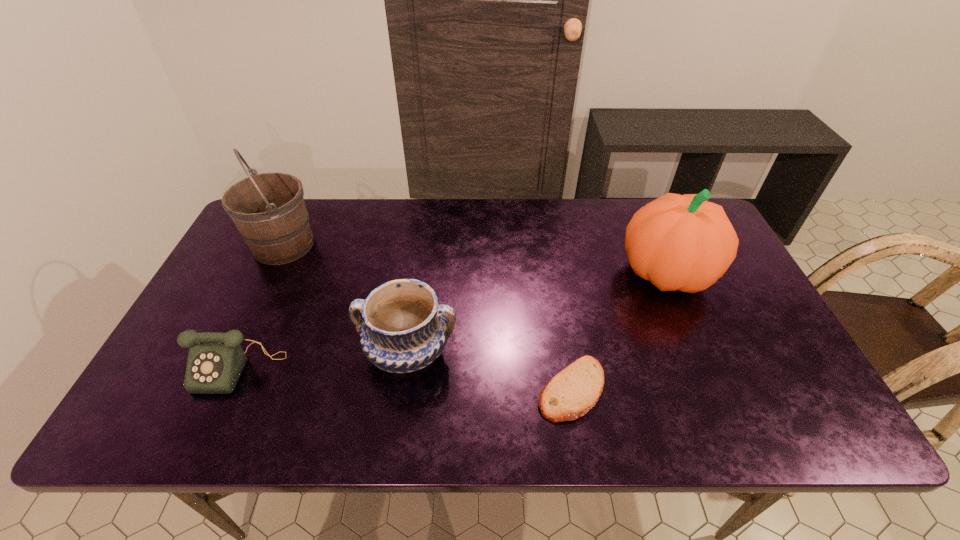
This screenshot has height=540, width=960. I want to click on free space at the far edge of the desktop, so click(x=503, y=207).

You are a GUI agent. You are given a task and a screenshot of the screen. Output one action in this format:
    pyautogui.click(x=<x>, y=<y>)
    Task: Click on the free space at the near edge of the desktop
    This screenshot has height=540, width=960.
    Given the screenshot: What is the action you would take?
    pyautogui.click(x=272, y=406)

What are the coordinates of `free region at the right edge of the desktop` in the screenshot? It's located at (766, 335).

Identify the location of vacant point located between the pumpkin and the third shortest object. The width and height of the screenshot is (960, 540). (538, 312).

You are a GUI agent. You are given a task and a screenshot of the screen. Output one action in this format:
    pyautogui.click(x=<x>, y=<y>)
    Task: Click on the blank region between the pita bread and the pottery
    
    Given the screenshot: What is the action you would take?
    pyautogui.click(x=490, y=370)

The width and height of the screenshot is (960, 540). What are the coordinates of `free space between the second shortest object and the third tallest object` in the screenshot? It's located at (324, 360).

At what (x,y) coordinates should I click in order to perform the action: click on free space between the third object from right to left and the bucket. Please return your answer as a coordinate pair (x, y). The height and width of the screenshot is (540, 960). Looking at the image, I should click on coord(346,298).

This screenshot has width=960, height=540. Find the location of `unoccupied position between the second object from right to left and the third tallest object`. unoccupied position between the second object from right to left and the third tallest object is located at coordinates (490, 370).

Identify the location of vacant point located between the fourth tallest object and the bucket. The image size is (960, 540). [261, 306].

Where is `free spot between the third shortest object and the telephone`? free spot between the third shortest object and the telephone is located at coordinates (324, 360).